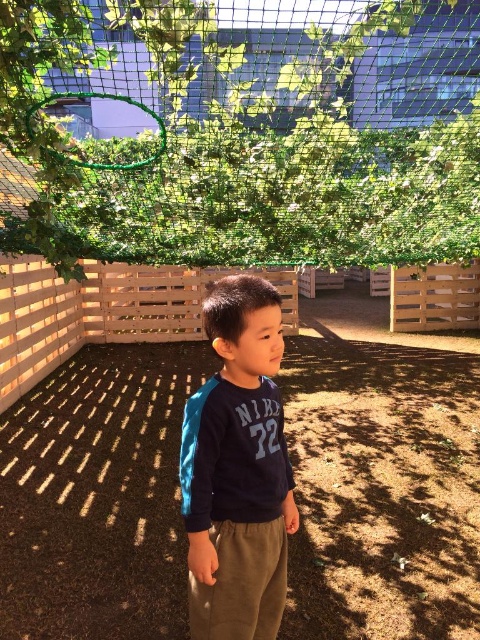
You are a photographer trying to capture the child in the scene. The child is wearing a navy blue sweatshirt at center. To ensure the sweatshirt is in focus, where should you aim the camera? Please provide the coordinates from the Objects Description.

The navy blue sweatshirt at center is located at point (238, 470), so aim the camera at those coordinates to focus on the sweatshirt.

You are a painter who needs to set up an easel between the green mesh netting at upper center and the wooden fence at center. The easel requires a minimum of 15 feet of space between the two objects to be placed safely. Based on the scene, can you safely place your easel there?

The distance between the green mesh netting at upper center and the wooden fence at center is 19.14 feet, which is more than the required 15 feet. Therefore, you can safely place your easel there.